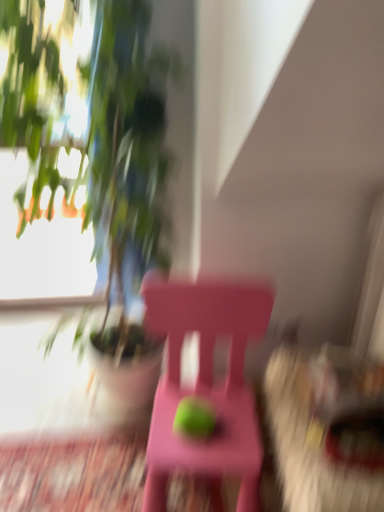
Question: Is green matte plant at upper left wider than green matte apple at center?

Choices:
 (A) yes
 (B) no

Answer: (A)

Question: From the image's perspective, is green matte plant at upper left on top of green matte apple at center?

Choices:
 (A) yes
 (B) no

Answer: (A)

Question: Is green matte plant at upper left smaller than green matte apple at center?

Choices:
 (A) yes
 (B) no

Answer: (B)

Question: Does green matte plant at upper left have a lesser height compared to green matte apple at center?

Choices:
 (A) no
 (B) yes

Answer: (A)

Question: From the image's perspective, is green matte plant at upper left below green matte apple at center?

Choices:
 (A) yes
 (B) no

Answer: (B)

Question: Relative to pink plastic chair at center, is green matte apple at center in front or behind?

Choices:
 (A) behind
 (B) front

Answer: (A)

Question: From a real-world perspective, is green matte apple at center physically located above or below pink plastic chair at center?

Choices:
 (A) above
 (B) below

Answer: (A)

Question: Considering the relative positions of green matte apple at center and pink plastic chair at center in the image provided, is green matte apple at center to the left or to the right of pink plastic chair at center?

Choices:
 (A) right
 (B) left

Answer: (B)

Question: In terms of height, does green matte apple at center look taller or shorter compared to pink plastic chair at center?

Choices:
 (A) tall
 (B) short

Answer: (B)

Question: In the image, is green matte plant at upper left on the left side or the right side of pink plastic chair at center?

Choices:
 (A) left
 (B) right

Answer: (A)

Question: From a real-world perspective, relative to pink plastic chair at center, is green matte plant at upper left vertically above or below?

Choices:
 (A) below
 (B) above

Answer: (B)

Question: Is green matte plant at upper left bigger or smaller than pink plastic chair at center?

Choices:
 (A) small
 (B) big

Answer: (B)

Question: In terms of width, does green matte plant at upper left look wider or thinner when compared to pink plastic chair at center?

Choices:
 (A) thin
 (B) wide

Answer: (B)

Question: Choose the correct answer: Is pink plastic chair at center inside green matte plant at upper left or outside it?

Choices:
 (A) inside
 (B) outside

Answer: (A)

Question: Considering the positions of pink plastic chair at center and green matte plant at upper left in the image, is pink plastic chair at center taller or shorter than green matte plant at upper left?

Choices:
 (A) short
 (B) tall

Answer: (A)